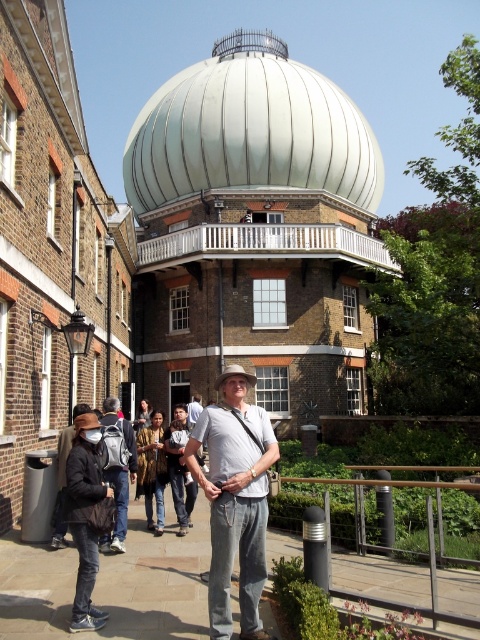
Between light gray cotton shirt at center and matte gray backpack at center-left, which one has less height?

matte gray backpack at center-left is shorter.

From the picture: Can you confirm if light gray cotton shirt at center is smaller than matte gray backpack at center-left?

Actually, light gray cotton shirt at center might be larger than matte gray backpack at center-left.

Does point (228, 417) come closer to viewer compared to point (130, 461)?

Yes, it is.

This screenshot has width=480, height=640. What are the coordinates of `light gray cotton shirt at center` in the screenshot? It's located at (235, 500).

Which is behind, point (331, 156) or point (82, 541)?

Positioned behind is point (331, 156).

Does point (144, 150) come in front of point (98, 426)?

No, (144, 150) is further to viewer.

Identify the location of white metallic dome at center. The width and height of the screenshot is (480, 640). (251, 131).

Is point (454, 586) behind point (96, 566)?

Yes, it is.

Is black metal/rail at lower center closer to the viewer compared to dark brown leather jacket at lower left?

That is True.

Describe the element at coordinates (393, 547) in the screenshot. I see `black metal/rail at lower center` at that location.

The height and width of the screenshot is (640, 480). Find the location of `black metal/rail at lower center`. black metal/rail at lower center is located at coordinates (393, 547).